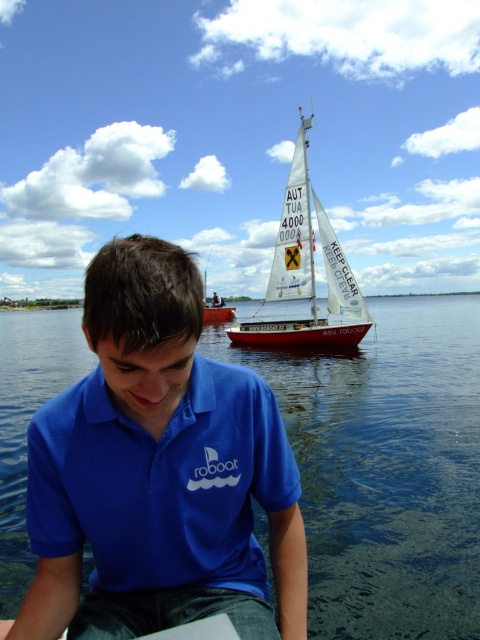
You are a photographer trying to capture the scene of the person in the blue cotton polo shirt at center and the transparent blue water at lower center. Based on their relative sizes, which object would appear larger in your photo?

The transparent blue water at lower center appears much larger in the photo because it is described as much taller than the blue cotton polo shirt at center.

You are standing on the dock and want to jump into the transparent blue water at lower center. If your maximum comfortable jumping distance is 4 meters, will you be able to reach it?

The transparent blue water at lower center is 4.50 meters away from the camera, which is beyond your maximum comfortable jumping distance of 4 meters. Therefore, you would not be able to reach it comfortably.